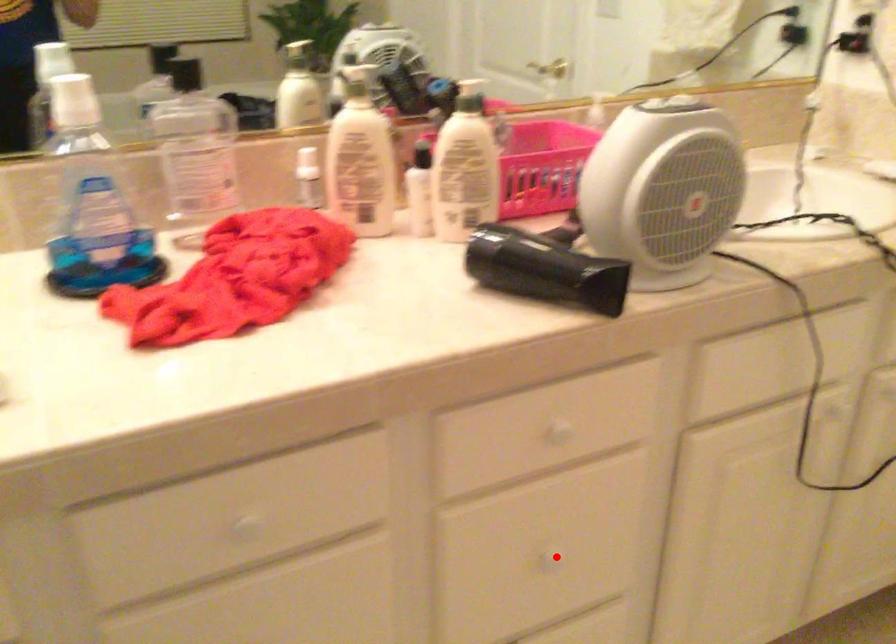
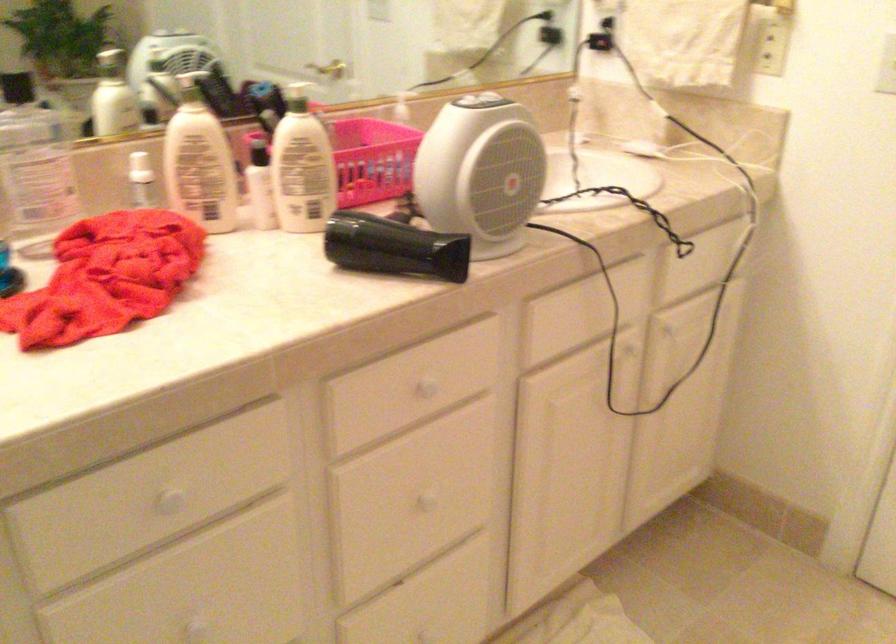
Locate, in the second image, the point that corresponds to the highlighted location in the first image.

(426, 500)